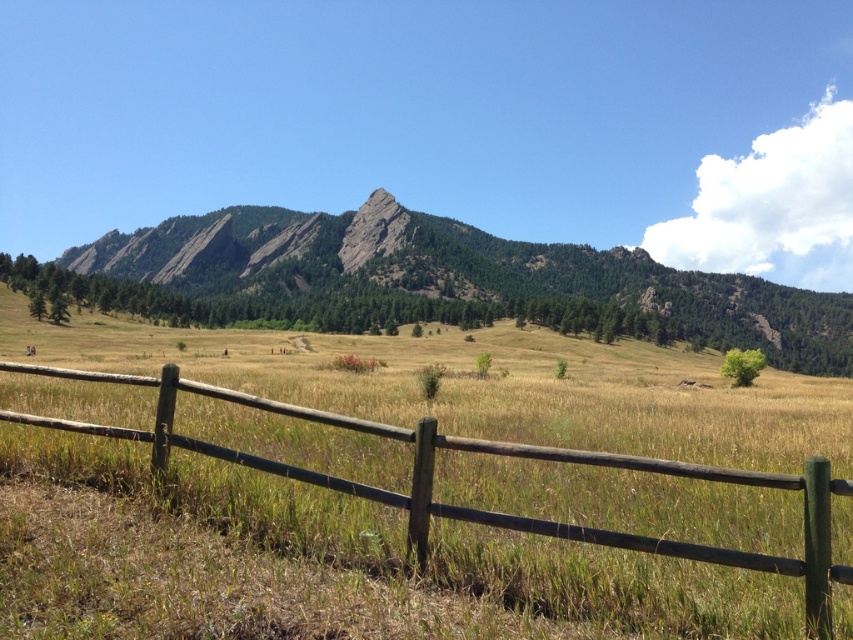
Is green grassy mountain at center bigger than brown wooden fence at lower center?

Indeed, green grassy mountain at center has a larger size compared to brown wooden fence at lower center.

Find the location of a particular element. The image size is (853, 640). green grassy mountain at center is located at coordinates (465, 273).